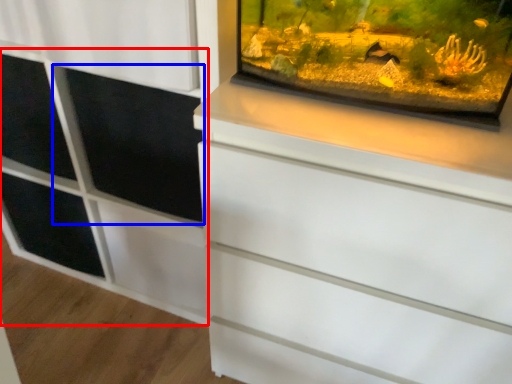
Question: Among these objects, which one is farthest to the camera, side cabinet (highlighted by a red box) or screen door (highlighted by a blue box)?

Choices:
 (A) side cabinet
 (B) screen door

Answer: (B)